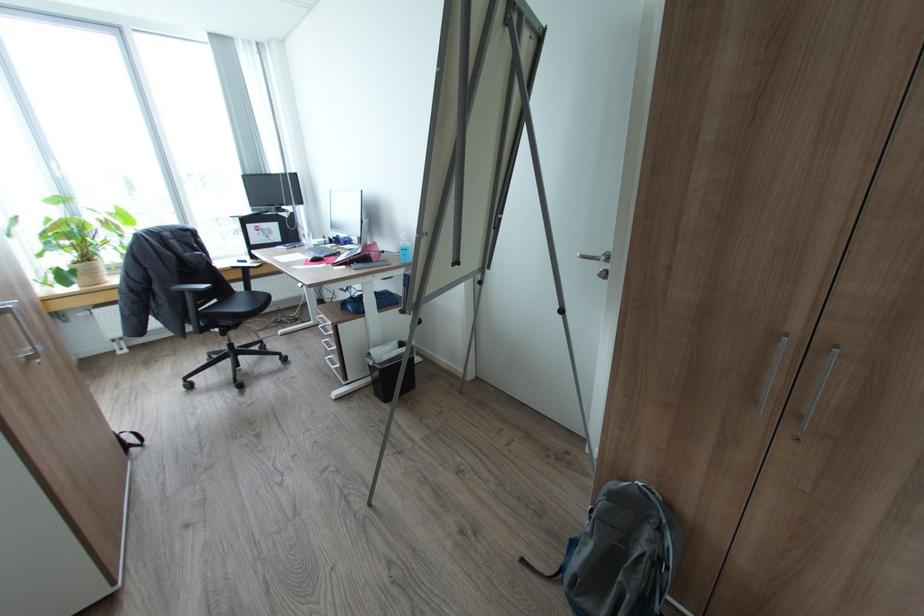
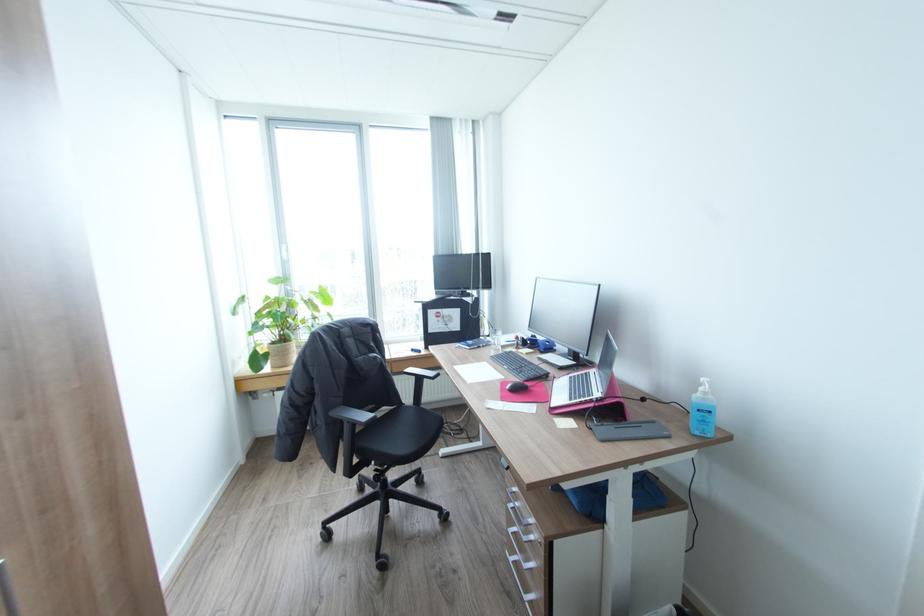
Where in the second image is the point corresponding to (x=310, y=264) from the first image?

(507, 399)